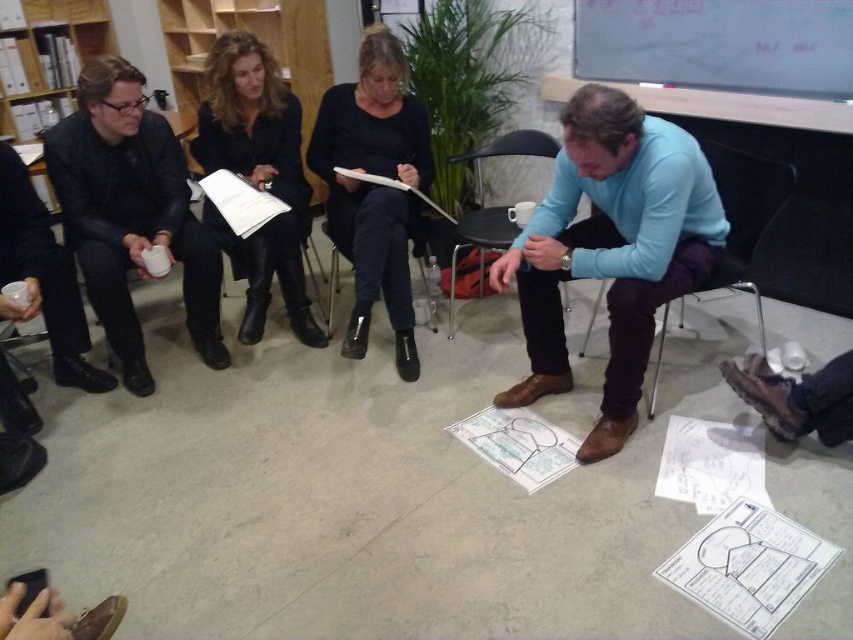
Question: Does light blue sweater at center have a greater width compared to matte black jacket at left?

Choices:
 (A) no
 (B) yes

Answer: (B)

Question: Which object is the farthest from the light blue sweater at center?

Choices:
 (A) black plastic chair at center
 (B) velvet black jacket at upper center

Answer: (B)

Question: Which of the following is the closest to the observer?

Choices:
 (A) (409, 230)
 (B) (485, 228)
 (C) (335, 275)
 (D) (148, 211)

Answer: (D)

Question: Observing the image, what is the correct spatial positioning of whiteboard at upper center in reference to white paper at lower center?

Choices:
 (A) below
 (B) above

Answer: (B)

Question: Among these objects, which one is farthest from the camera?

Choices:
 (A) velvet black jacket at upper center
 (B) matte black jacket at left

Answer: (A)

Question: Is matte black jacket at left smaller than black leather boots at center?

Choices:
 (A) no
 (B) yes

Answer: (A)